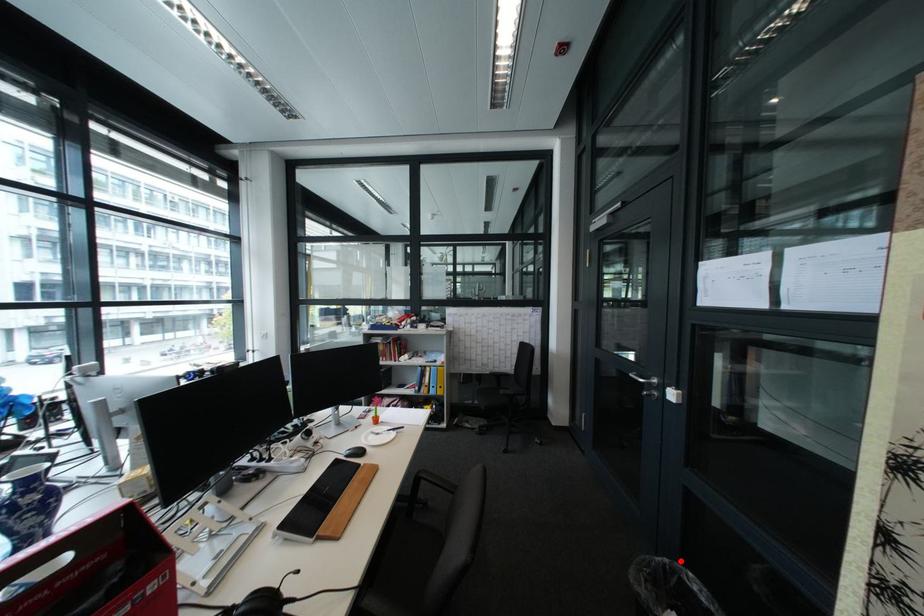
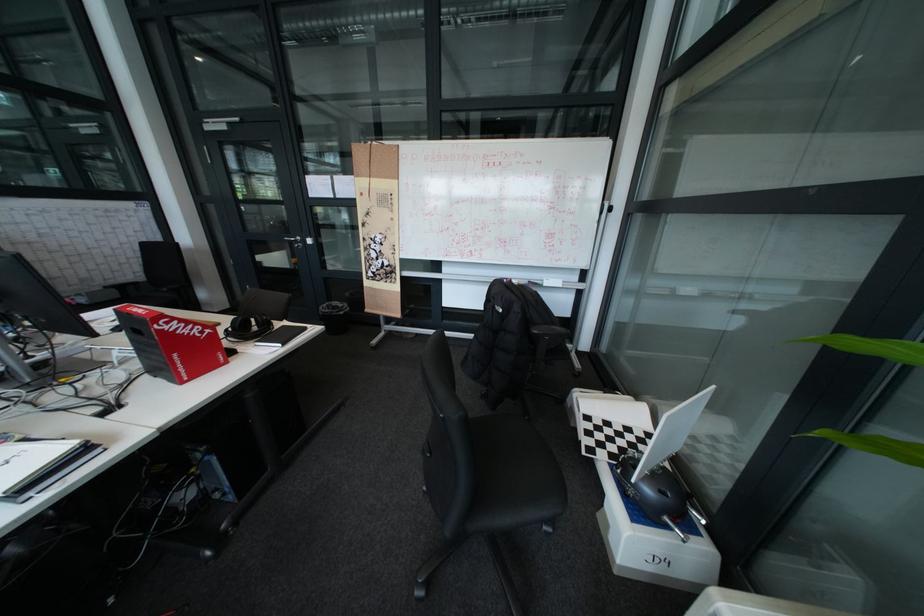
Locate, in the second image, the point that corresponds to the highlighted location in the first image.

(341, 304)